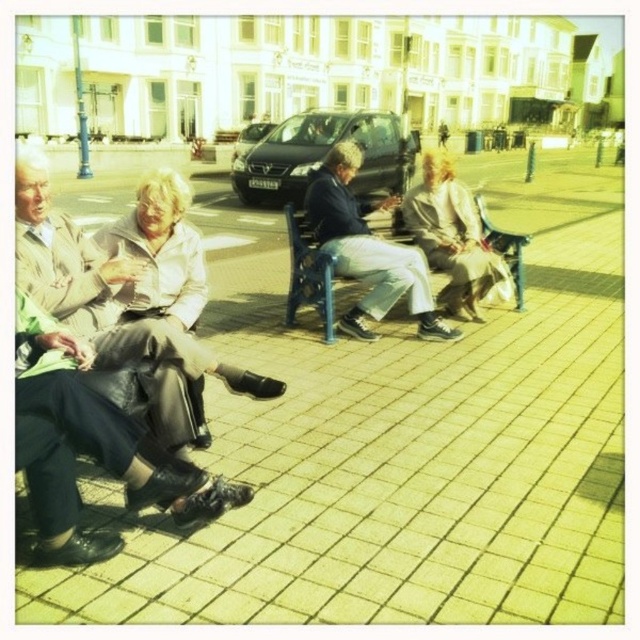
Question: Is yellow brick pavement at center closer to camera compared to light beige leather jacket at left?

Choices:
 (A) no
 (B) yes

Answer: (B)

Question: Which point is farther from the camera taking this photo?

Choices:
 (A) (416, 224)
 (B) (448, 490)
 (C) (144, 356)
 (D) (342, 317)

Answer: (A)

Question: Is yellow brick pavement at center wider than light beige fabric coat at center?

Choices:
 (A) yes
 (B) no

Answer: (A)

Question: Which object appears closest to the camera in this image?

Choices:
 (A) yellow brick pavement at center
 (B) light beige leather jacket at left

Answer: (A)

Question: Is light beige leather jacket at left behind light beige fabric coat at center?

Choices:
 (A) yes
 (B) no

Answer: (B)

Question: Which object appears closest to the camera in this image?

Choices:
 (A) yellow brick pavement at center
 (B) light beige fabric coat at center
 (C) light blue fabric jacket at center

Answer: (A)